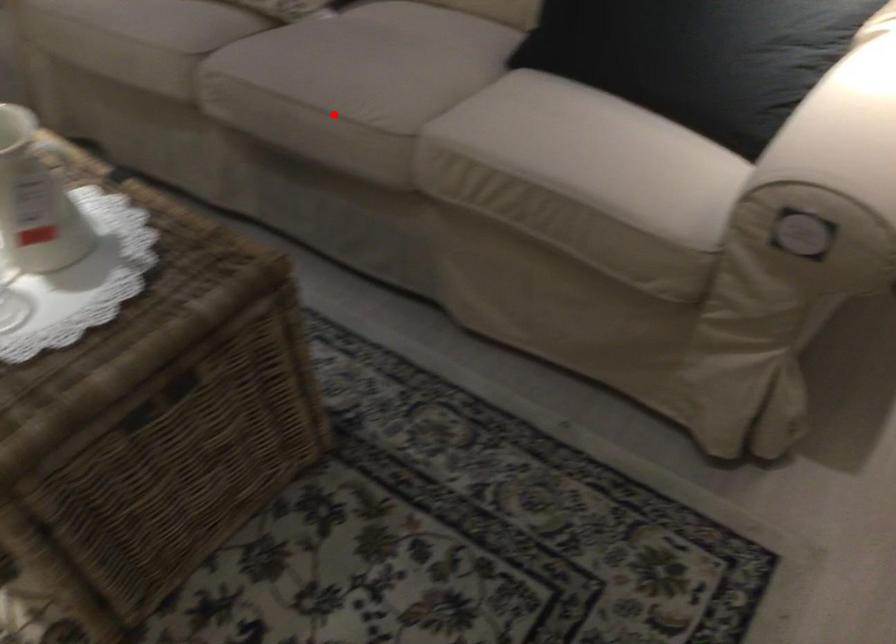
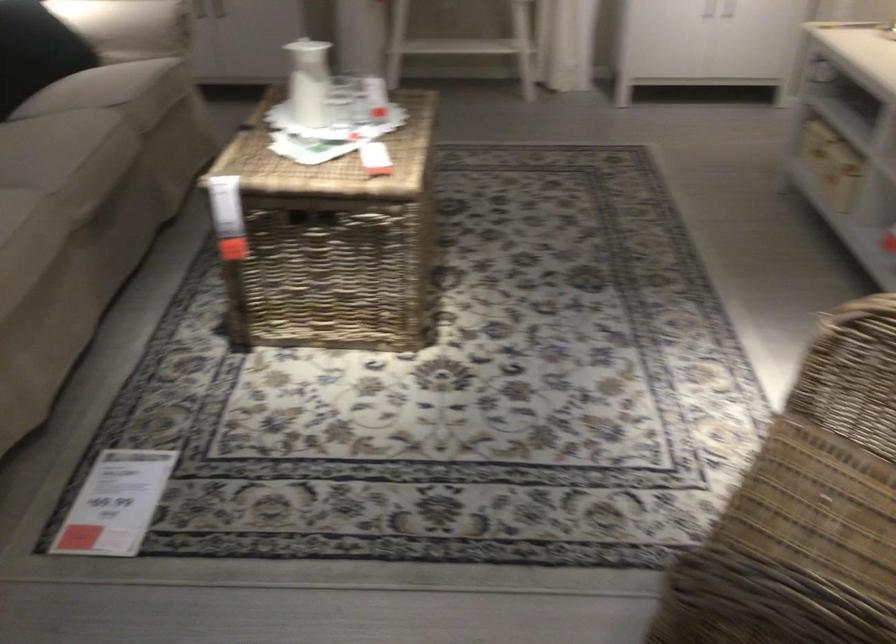
Where in the second image is the point corresponding to the highlighted location from the first image?

(109, 140)